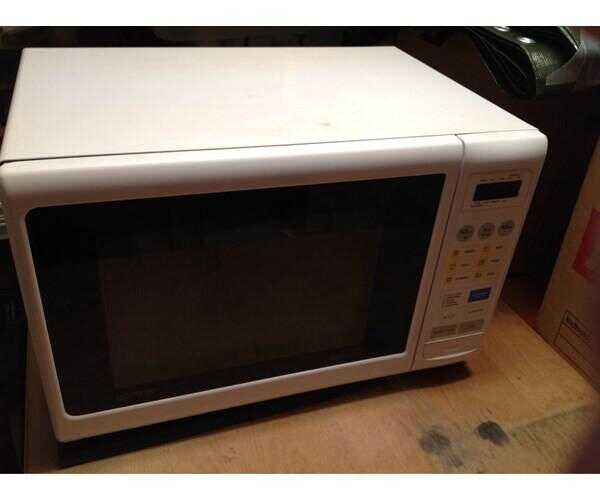
At what (x,y) coordinates should I click in order to perform the action: click on 2 black spots on wooden surface. Please return your answer as a coordinate pair (x, y). The height and width of the screenshot is (500, 600). Looking at the image, I should click on (433, 437), (490, 432).